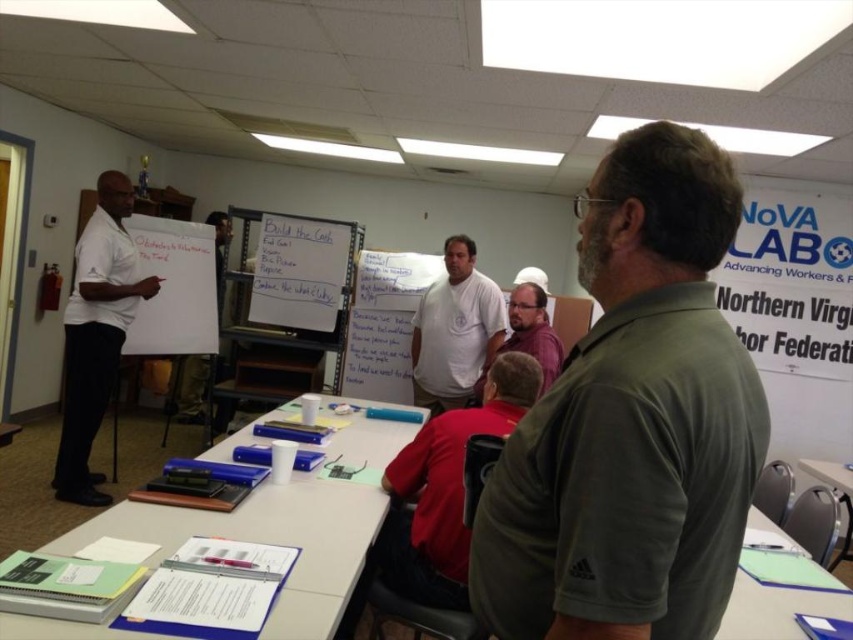
Who is more forward, (538, 296) or (193, 417)?

Point (538, 296) is more forward.

Does point (523, 323) come behind point (200, 401)?

No, (523, 323) is closer to viewer.

The width and height of the screenshot is (853, 640). Find the location of `matte purple shirt at center`. matte purple shirt at center is located at coordinates (532, 330).

Can you confirm if green matte shirt at center is positioned to the left of white paper at center?

No, green matte shirt at center is not to the left of white paper at center.

Is green matte shirt at center taller than white paper at center?

Yes.

Is point (592, 595) behind point (343, 488)?

No, it is in front of (343, 488).

You are a GUI agent. You are given a task and a screenshot of the screen. Output one action in this format:
    pyautogui.click(x=<x>, y=<y>)
    Task: Click on the green matte shirt at center
    Image resolution: width=853 pixels, height=640 pixels.
    Given the screenshot: What is the action you would take?
    pyautogui.click(x=631, y=420)

Is point (323, 397) closer to viewer compared to point (502, 314)?

Yes, point (323, 397) is closer to viewer.

Does white paper at center have a smaller size compared to white cotton shirt at center?

Actually, white paper at center might be larger than white cotton shirt at center.

Find the location of a particular element. The width and height of the screenshot is (853, 640). white paper at center is located at coordinates (265, 540).

Locate an element on the screen. white paper at center is located at coordinates (265, 540).